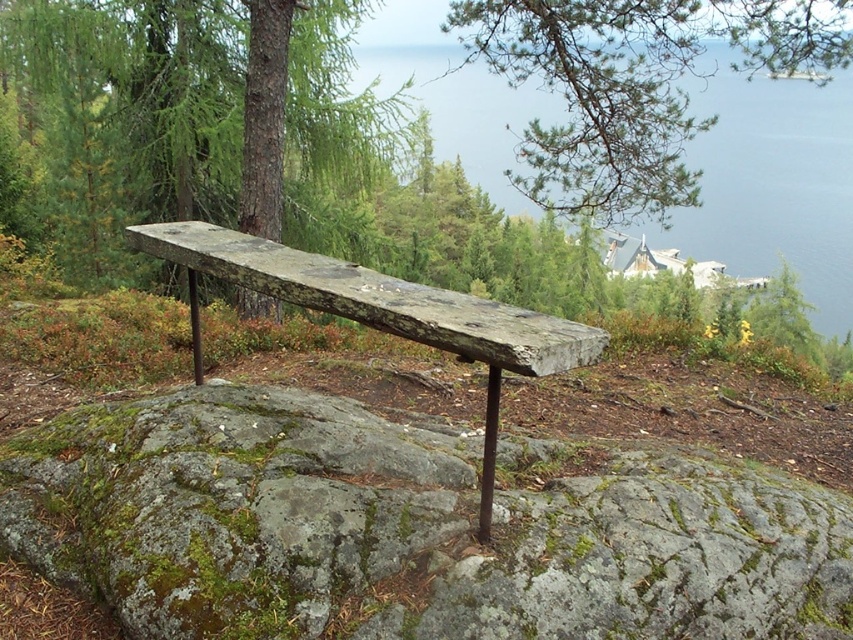
Question: In this image, where is green textured pine branch at upper center located relative to transparent blue water at upper center?

Choices:
 (A) right
 (B) left

Answer: (B)

Question: Which point appears closest to the camera in this image?

Choices:
 (A) (772, 65)
 (B) (28, 480)

Answer: (B)

Question: Is the position of green textured pine branch at upper center more distant than that of transparent blue water at upper center?

Choices:
 (A) no
 (B) yes

Answer: (A)

Question: Is green textured pine branch at upper center positioned behind transparent blue water at upper center?

Choices:
 (A) yes
 (B) no

Answer: (B)

Question: Estimate the real-world distances between objects in this image. Which object is farther from the green mossy rock at center?

Choices:
 (A) green textured pine branch at upper center
 (B) weathered wood bench at center

Answer: (A)

Question: Which point appears closest to the camera in this image?

Choices:
 (A) (410, 292)
 (B) (293, 477)
 (C) (732, 19)

Answer: (A)